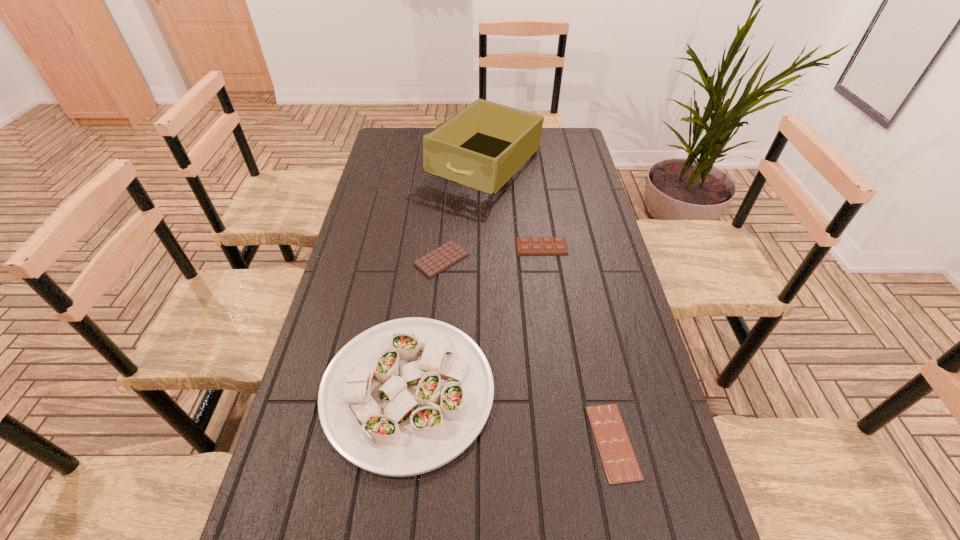
You are a GUI agent. You are given a task and a screenshot of the screen. Output one action in this format:
    pyautogui.click(x=<x>, y=<y>)
    Task: Click on the farthest object
    This screenshot has height=540, width=960.
    Given the screenshot: What is the action you would take?
    pyautogui.click(x=482, y=147)

Where is `box`? box is located at coordinates (482, 147).

At what (x,y) coordinates should I click in order to perform the action: click on platter. Please return your answer as a coordinate pair (x, y). This screenshot has height=540, width=960. Looking at the image, I should click on (405, 397).

The height and width of the screenshot is (540, 960). What are the coordinates of `the tallest chocolate bar` in the screenshot? It's located at (538, 245).

Locate an element on the screen. The width and height of the screenshot is (960, 540). the leftmost chocolate bar is located at coordinates (431, 264).

Locate an element on the screen. This screenshot has height=540, width=960. the second shortest chocolate bar is located at coordinates (431, 264).

At what (x,y) coordinates should I click in order to perform the action: click on the shortest chocolate bar. Please return your answer as a coordinate pair (x, y). Looking at the image, I should click on (620, 464).

Image resolution: width=960 pixels, height=540 pixels. In order to click on the shortest object in this screenshot , I will do `click(620, 464)`.

Identify the location of free space located 0.130m on the front of the box. (487, 228).

The height and width of the screenshot is (540, 960). What are the coordinates of `free spot located on the right of the second tallest object` in the screenshot? It's located at (652, 389).